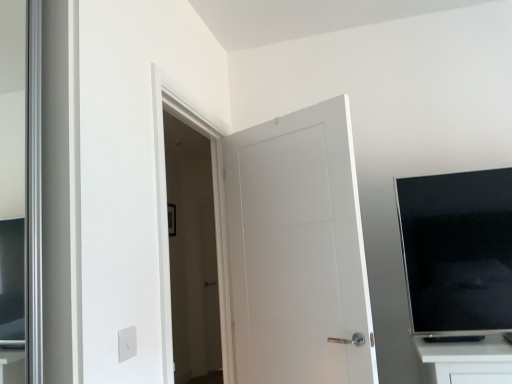
Question: Is white matte door at center surrounding black glossy tv at upper right?

Choices:
 (A) no
 (B) yes

Answer: (A)

Question: Would you consider white matte door at center to be distant from black glossy tv at upper right?

Choices:
 (A) yes
 (B) no

Answer: (B)

Question: Does white matte door at center touch black glossy tv at upper right?

Choices:
 (A) yes
 (B) no

Answer: (B)

Question: Is white matte door at center not inside black glossy tv at upper right?

Choices:
 (A) no
 (B) yes

Answer: (B)

Question: From a real-world perspective, is white matte door at center on top of black glossy tv at upper right?

Choices:
 (A) no
 (B) yes

Answer: (B)

Question: Can you confirm if white matte door at center is bigger than black glossy tv at upper right?

Choices:
 (A) yes
 (B) no

Answer: (A)

Question: Is black glossy tv at upper right further to the viewer compared to white matte door at center?

Choices:
 (A) no
 (B) yes

Answer: (A)

Question: Is black glossy tv at upper right oriented away from white matte door at center?

Choices:
 (A) no
 (B) yes

Answer: (A)

Question: From the image's perspective, is black glossy tv at upper right under white matte door at center?

Choices:
 (A) yes
 (B) no

Answer: (B)

Question: Is black glossy tv at upper right shorter than white matte door at center?

Choices:
 (A) yes
 (B) no

Answer: (A)

Question: Does black glossy tv at upper right appear on the left side of white matte door at center?

Choices:
 (A) no
 (B) yes

Answer: (A)

Question: From the image's perspective, is black glossy tv at upper right on white matte door at center?

Choices:
 (A) yes
 (B) no

Answer: (A)

Question: Based on their positions, is black glossy tv at upper right located to the left or right of white matte door at center?

Choices:
 (A) right
 (B) left

Answer: (A)